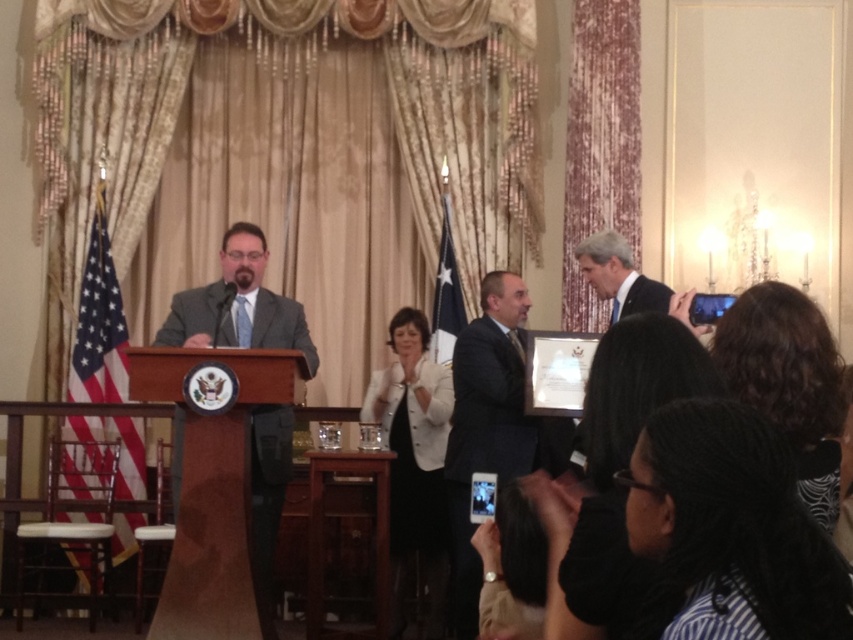
You are attending a formal event and notice two men dressed in gray suits. The man in the matte gray suit at left is standing next to the dark gray suit at center. Based on their attire, which man is shorter?

The matte gray suit at left is shorter than the dark gray suit at center.

You are attending a formal event and see two men dressed in a matte gray suit at left and a dark blue suit at center. Which man is standing to the right of the other?

The dark blue suit at center is to the right of the matte gray suit at left.